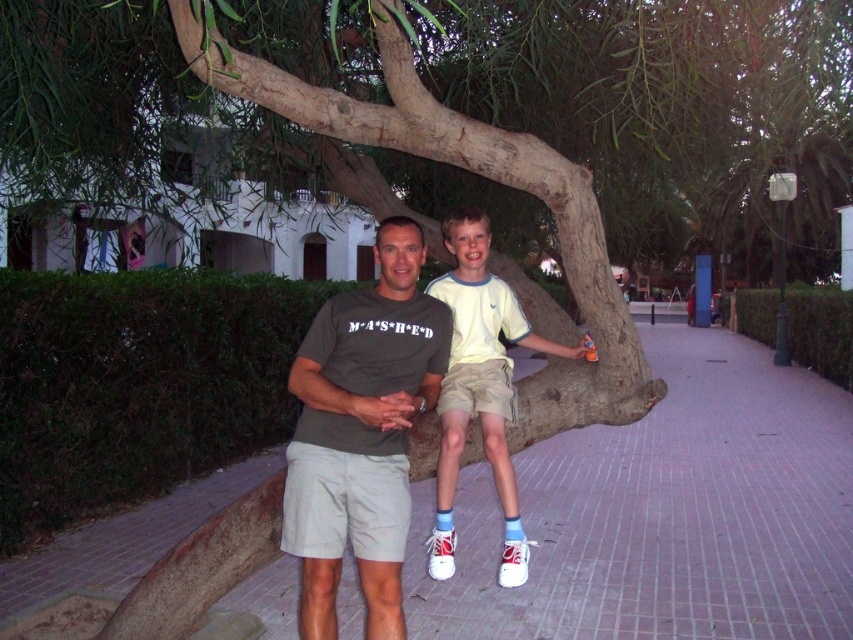
Does pink brick pavement at center have a smaller size compared to brown rough tree trunk at center?

No, pink brick pavement at center is not smaller than brown rough tree trunk at center.

Which is in front, point (834, 406) or point (527, 308)?

Positioned in front is point (527, 308).

In order to click on pink brick pavement at center in this screenshot , I will do `click(665, 515)`.

Is brown rough tree trunk at center wider than matte gray shorts at center?

Yes, brown rough tree trunk at center is wider than matte gray shorts at center.

Describe the element at coordinates (433, 220) in the screenshot. The height and width of the screenshot is (640, 853). I see `brown rough tree trunk at center` at that location.

Which is behind, point (525, 396) or point (415, 371)?

Positioned behind is point (525, 396).

Locate an element on the screen. brown rough tree trunk at center is located at coordinates (433, 220).

Can you confirm if matte gray shorts at center is smaller than light yellow t-shirt at center?

No.

Who is shorter, matte gray shorts at center or light yellow t-shirt at center?

With less height is light yellow t-shirt at center.

Where is `matte gray shorts at center`? matte gray shorts at center is located at coordinates (361, 433).